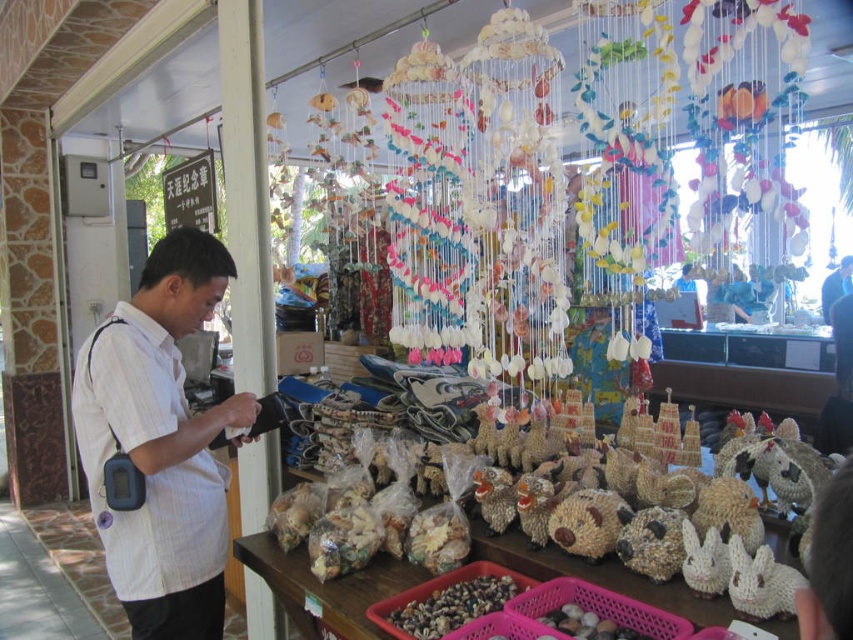
You are a customer at this market stall and want to buy both the brown woven baskets at center and the smooth brown shells at lower center. Which item should you approach first if you want to start from the left side of the stall?

The smooth brown shells at lower center should be approached first since it is located to the left of the brown woven baskets at center.

You are a customer at the market stall and want to place a small seashell necklace on either the brown woven baskets at center or the smooth brown shells at lower center. Which surface will allow the necklace to be more visible to other customers?

The brown woven baskets at center are taller than the smooth brown shells at lower center, so placing the necklace on the brown woven baskets at center will make it more visible to other customers.